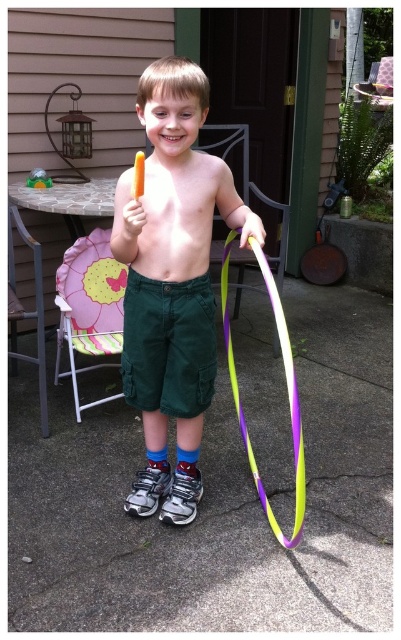
Can you confirm if dark green cotton shorts at center is taller than green plastic toy at center?

Correct, dark green cotton shorts at center is much taller as green plastic toy at center.

Is dark green cotton shorts at center positioned before green plastic toy at center?

Yes, it is in front of green plastic toy at center.

Is point (204, 304) in front of point (44, 177)?

Yes, point (204, 304) is in front of point (44, 177).

Find the location of a particular element. dark green cotton shorts at center is located at coordinates (168, 346).

Which is behind, point (303, 472) or point (42, 180)?

Positioned behind is point (42, 180).

Measure the distance between rubberized neon hula hoop at right and camera.

rubberized neon hula hoop at right is 1.12 meters away from camera.

Who is more distant from viewer, (x=251, y=241) or (x=40, y=184)?

Positioned behind is point (x=40, y=184).

Identify the location of rubberized neon hula hoop at right. This screenshot has width=401, height=640. (287, 390).

Does matte green shorts at center come behind dark green cotton shorts at center?

That is False.

Consider the image. Is matte green shorts at center wider than dark green cotton shorts at center?

Yes, matte green shorts at center is wider than dark green cotton shorts at center.

Find the location of a particular element. This screenshot has width=401, height=640. matte green shorts at center is located at coordinates (176, 180).